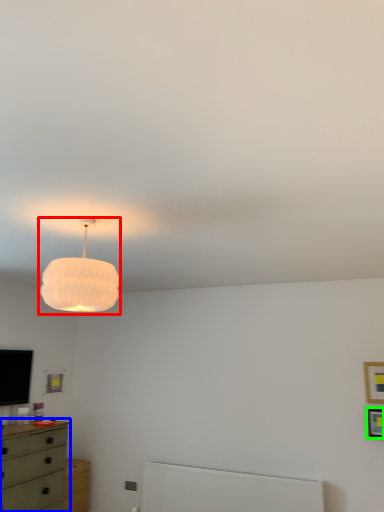
Question: Considering the real-world distances, which object is closest to lamp (highlighted by a red box)? chest of drawers (highlighted by a blue box) or picture frame (highlighted by a green box).

Choices:
 (A) chest of drawers
 (B) picture frame

Answer: (A)